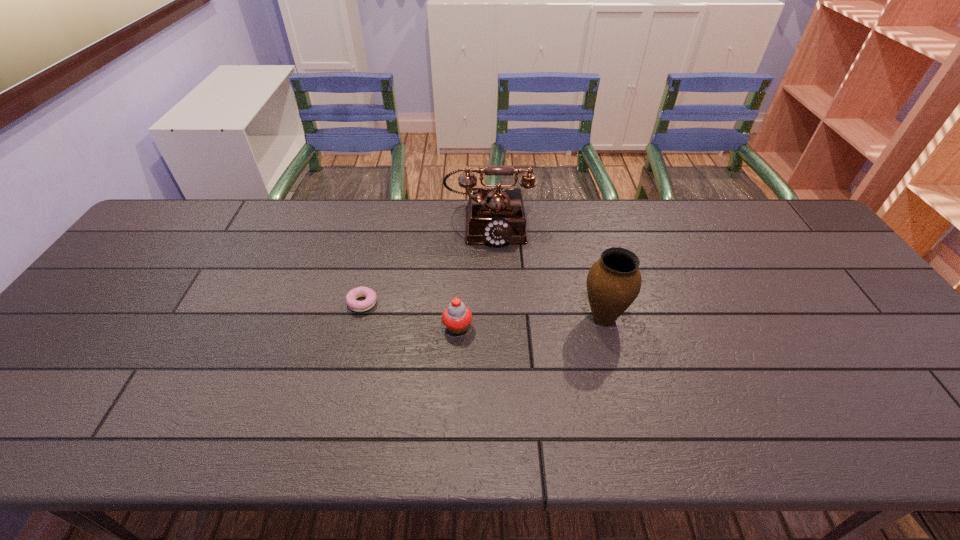
This screenshot has width=960, height=540. I want to click on vacant space at the far edge of the desktop, so click(x=651, y=212).

At what (x,y) coordinates should I click in order to perform the action: click on free region at the near edge of the desktop. Please return your answer as a coordinate pair (x, y). Image resolution: width=960 pixels, height=540 pixels. Looking at the image, I should click on (800, 431).

This screenshot has height=540, width=960. I want to click on vacant space at the left edge, so click(x=183, y=249).

Find the location of a particular element. The image size is (960, 540). vacant space at the right edge of the desktop is located at coordinates (812, 293).

You are a GUI agent. You are given a task and a screenshot of the screen. Output one action in this format:
    pyautogui.click(x=<x>, y=<y>)
    Task: Click on the vacant space at the far left corner
    This screenshot has height=540, width=960.
    Given the screenshot: What is the action you would take?
    pyautogui.click(x=216, y=204)

Image resolution: width=960 pixels, height=540 pixels. I want to click on vacant area at the far right corner, so click(806, 226).

Where is `free space that is in between the cupcake and the urn`? The image size is (960, 540). free space that is in between the cupcake and the urn is located at coordinates (531, 322).

Identify the location of unoccupied position between the farthest object and the third tallest object. (473, 275).

Where is `free point between the doughnut and the cupcake`? free point between the doughnut and the cupcake is located at coordinates (410, 315).

The height and width of the screenshot is (540, 960). Find the location of `vacant point located between the urn and the third tallest object`. vacant point located between the urn and the third tallest object is located at coordinates (531, 322).